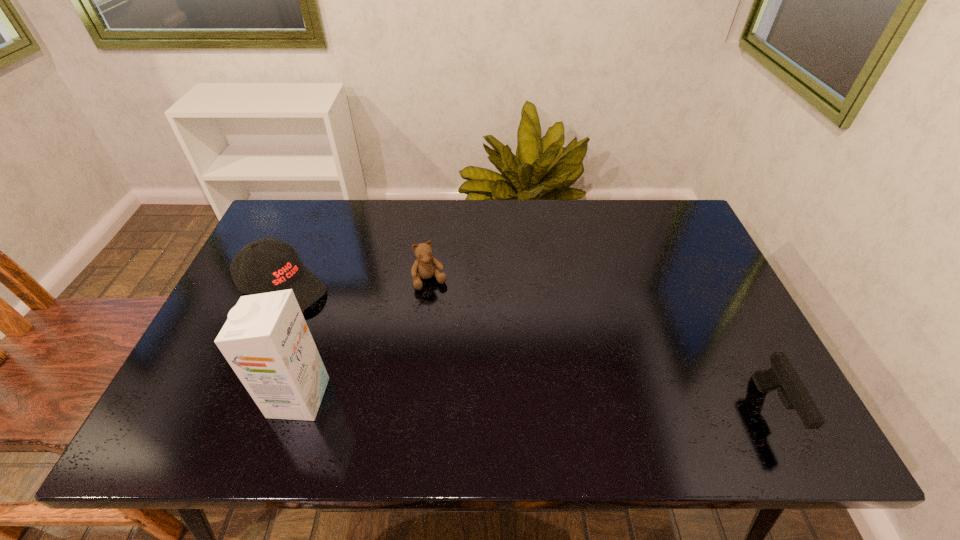
Where is `vacant space located 0.340m on the front-facing side of the second object from right to left`? The height and width of the screenshot is (540, 960). vacant space located 0.340m on the front-facing side of the second object from right to left is located at coordinates (480, 394).

The width and height of the screenshot is (960, 540). What are the coordinates of `carton situated at the near edge` in the screenshot? It's located at (266, 340).

At what (x,y) coordinates should I click in order to perform the action: click on pistol located in the near edge section of the desktop. Please return your answer as a coordinate pair (x, y). Looking at the image, I should click on (782, 376).

Image resolution: width=960 pixels, height=540 pixels. I want to click on object located in the left edge section of the desktop, so click(282, 269).

The height and width of the screenshot is (540, 960). I want to click on object at the right edge, so click(x=782, y=376).

This screenshot has height=540, width=960. In order to click on object that is at the near right corner in this screenshot , I will do `click(782, 376)`.

This screenshot has width=960, height=540. What are the coordinates of `free space at the far edge of the desktop` in the screenshot? It's located at (452, 206).

Image resolution: width=960 pixels, height=540 pixels. I want to click on vacant region at the near edge, so click(x=684, y=394).

Locate an element on the screen. vacant space at the left edge is located at coordinates (203, 349).

The image size is (960, 540). Identify the location of free space at the right edge of the desktop. (676, 257).